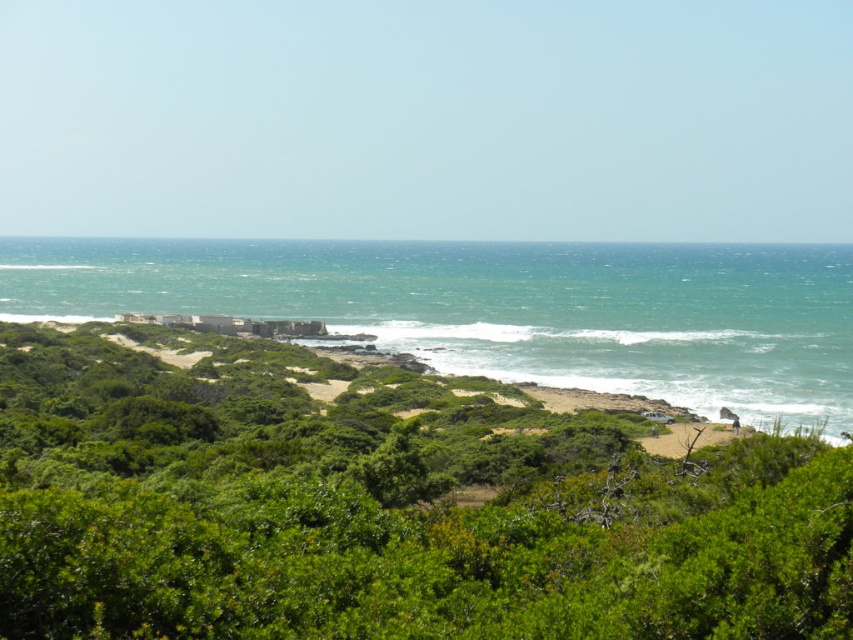
Question: Which point is closer to the camera taking this photo?

Choices:
 (A) (274, 438)
 (B) (305, 266)

Answer: (A)

Question: Can you confirm if green leafy shrubs at center is smaller than green water at center?

Choices:
 (A) yes
 (B) no

Answer: (A)

Question: Is green leafy shrubs at center positioned at the back of green water at center?

Choices:
 (A) no
 (B) yes

Answer: (A)

Question: Which point is farther to the camera?

Choices:
 (A) (357, 500)
 (B) (579, 298)

Answer: (B)

Question: Observing the image, what is the correct spatial positioning of green leafy shrubs at center in reference to green water at center?

Choices:
 (A) right
 (B) left

Answer: (A)

Question: Among these objects, which one is nearest to the camera?

Choices:
 (A) green leafy shrubs at center
 (B) green water at center

Answer: (A)